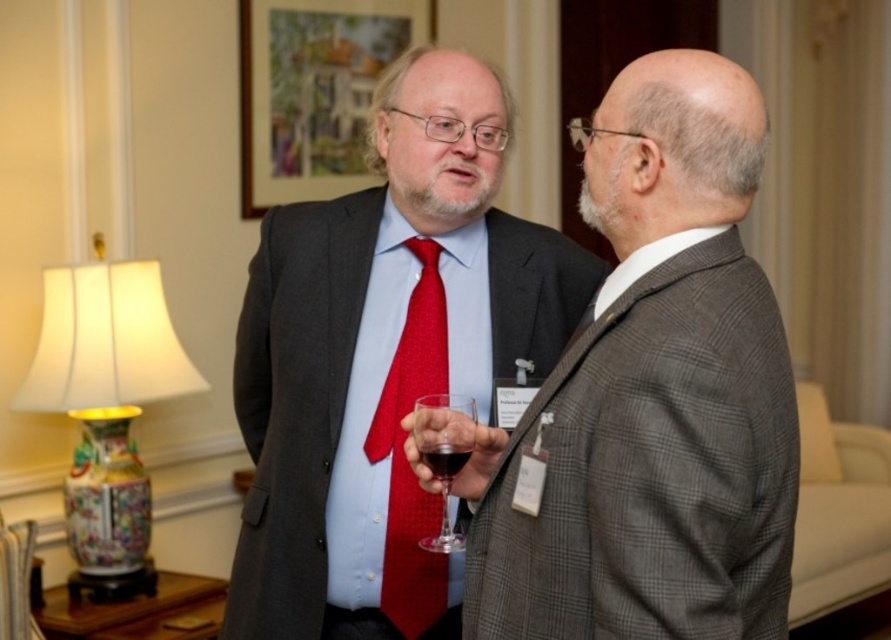
Does matte gray suit at center lie behind porcelain vase at left?

No.

Measure the distance between point (693, 416) and camera.

They are 3.99 feet apart.

I want to click on matte gray suit at center, so click(x=651, y=396).

Can you confirm if matte black suit at center is taller than red textured tie at center?

Correct, matte black suit at center is much taller as red textured tie at center.

Is matte black suit at center shorter than red textured tie at center?

No.

Which is in front, point (497, 147) or point (424, 522)?

Positioned in front is point (424, 522).

You are a GUI agent. You are given a task and a screenshot of the screen. Output one action in this format:
    pyautogui.click(x=<x>, y=<y>)
    Task: Click on the matte black suit at center
    This screenshot has width=891, height=640.
    Given the screenshot: What is the action you would take?
    pyautogui.click(x=383, y=356)

Does matte gray suit at center have a greater width compared to matte black suit at center?

In fact, matte gray suit at center might be narrower than matte black suit at center.

Is matte gray suit at center above matte black suit at center?

Yes, matte gray suit at center is above matte black suit at center.

Who is more distant from viewer, (706,310) or (437,580)?

The point (437,580) is behind.

The width and height of the screenshot is (891, 640). Identify the location of matte gray suit at center. [651, 396].